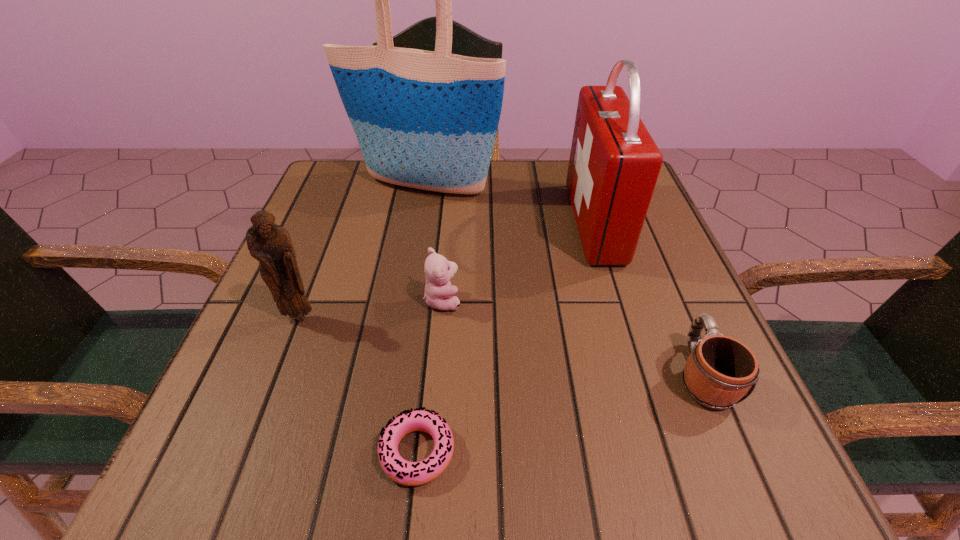
This screenshot has width=960, height=540. What are the coordinates of `free location that satisfies the following two spatial constraints: 1. on the front-facing side of the third tallest object; 2. on the left side of the nearest object` in the screenshot? It's located at (248, 452).